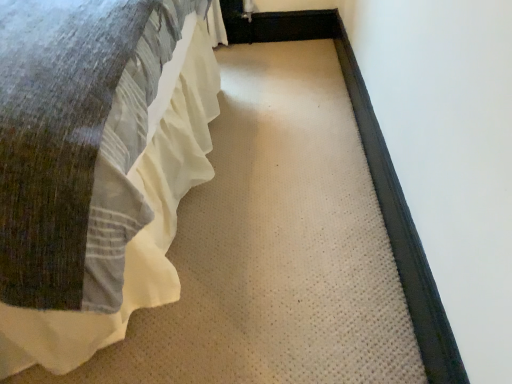
At what (x,y) coordinates should I click in order to perform the action: click on free area below black rubber doormat at right (from a real-world perspective). Please return your answer as a coordinate pair (x, y). The image size is (512, 384). Looking at the image, I should click on (367, 150).